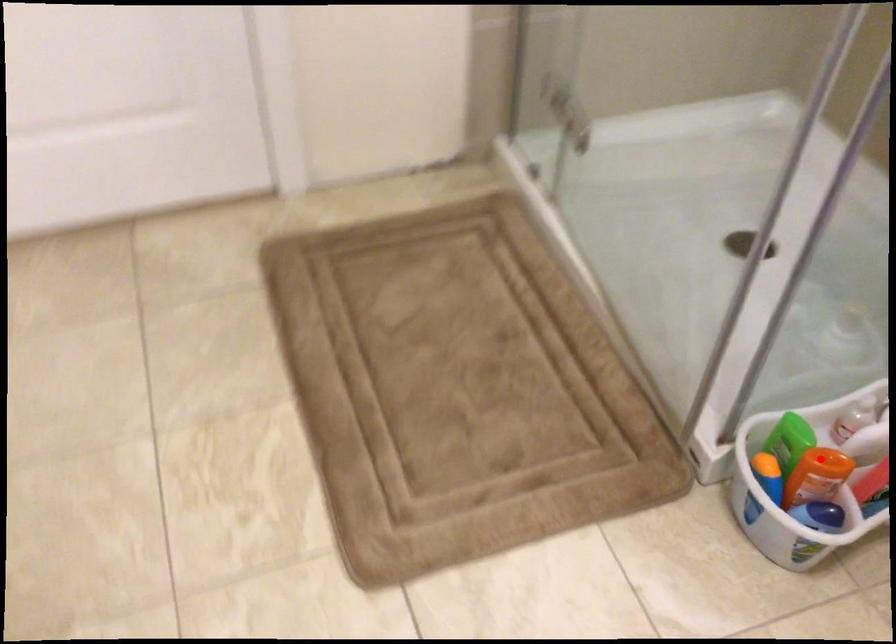
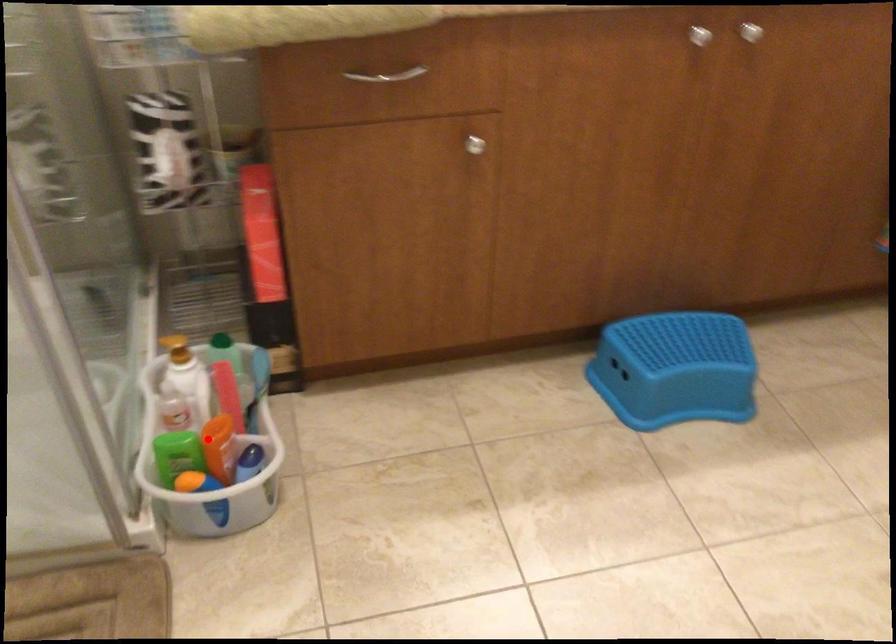
I am providing you with two images of the same scene from different viewpoints. A red point is marked on the first image and another point is marked on the second image. Is the red point in image1 aligned with the point shown in image2?

Yes